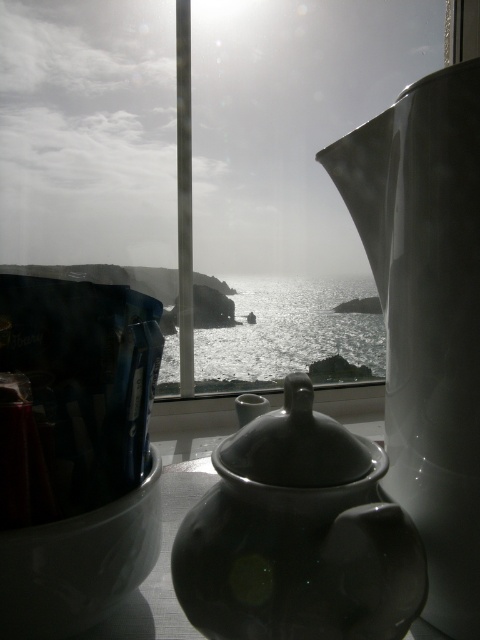
You are a painter standing in front of the transparent glass window at center and the white glossy teapot at right. You want to paint both objects but have limited canvas space. Which object should you prioritize painting first if you need to capture its full height?

The transparent glass window at center is much taller than the white glossy teapot at right, so you should prioritize painting the transparent glass window at center first to ensure its full height is captured.

You are a tea enthusiast who wants to pour tea from the matte black teapot at center into a cup placed on the glistening silver water at center. Considering their sizes, will the teapot fit over the water area without spilling?

The matte black teapot at center is thinner than the glistening silver water at center, so it should fit over the water area without spilling as long as the teapot is positioned carefully.

You are a guest in a coastal home and want to enjoy the view outside the transparent glass window at center while sipping tea from the matte black teapot at center. Can you see the window clearly while holding the teapot in your hand?

The transparent glass window at center is above the matte black teapot at center, so you can hold the matte black teapot at center and still see the window above it clearly.